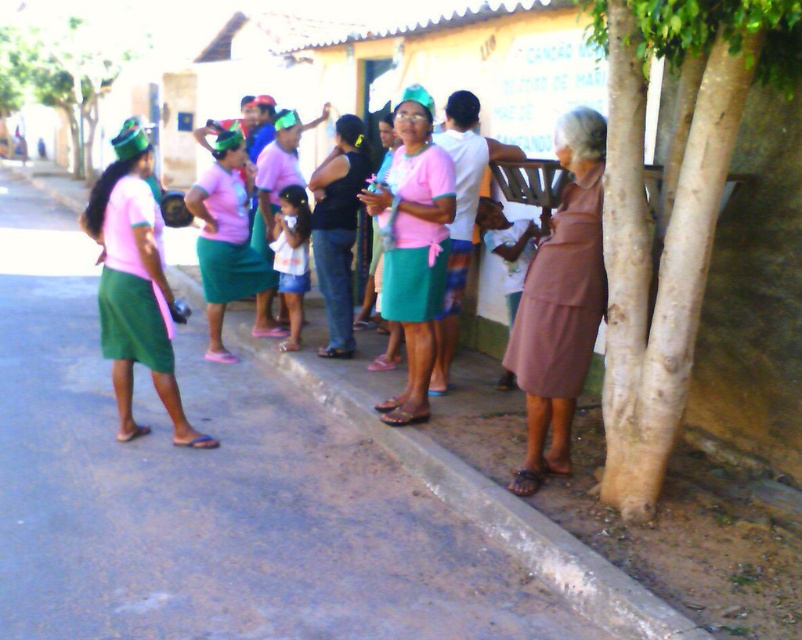
Is point (569, 300) positioned before point (152, 292)?

Yes.

Who is more distant from viewer, (562, 385) or (148, 296)?

The point (148, 296) is more distant.

The width and height of the screenshot is (802, 640). I want to click on brown fabric dress at lower right, so click(x=561, y=304).

Is white smooth tree trunk at right bigger than concrete at lower center?

No, white smooth tree trunk at right is not bigger than concrete at lower center.

Is white smooth tree trunk at right smaller than concrete at lower center?

Yes, white smooth tree trunk at right is smaller than concrete at lower center.

Is point (622, 52) positioned before point (584, 572)?

No, (622, 52) is further to viewer.

Where is `white smooth tree trunk at right`? white smooth tree trunk at right is located at coordinates (669, 212).

Is point (47, 58) closer to camera compared to point (439, 193)?

No, (47, 58) is further to viewer.

Locate an element on the screen. green leafy tree at upper left is located at coordinates click(x=61, y=74).

Is point (15, 74) in front of point (446, 163)?

No.

Where is `green leafy tree at upper left`? green leafy tree at upper left is located at coordinates (61, 74).